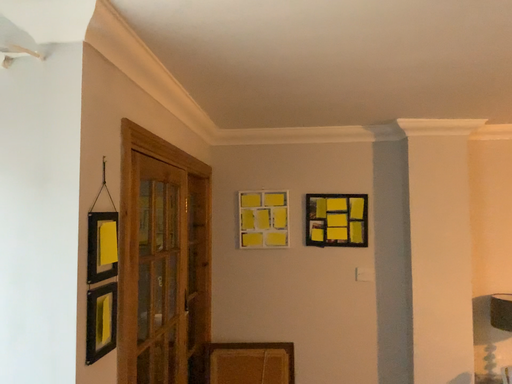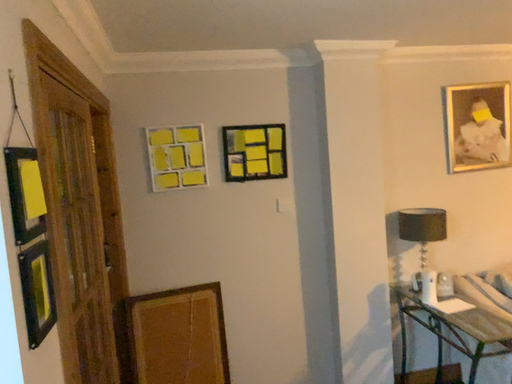
Question: How did the camera likely rotate when shooting the video?

Choices:
 (A) rotated downward
 (B) rotated upward

Answer: (A)